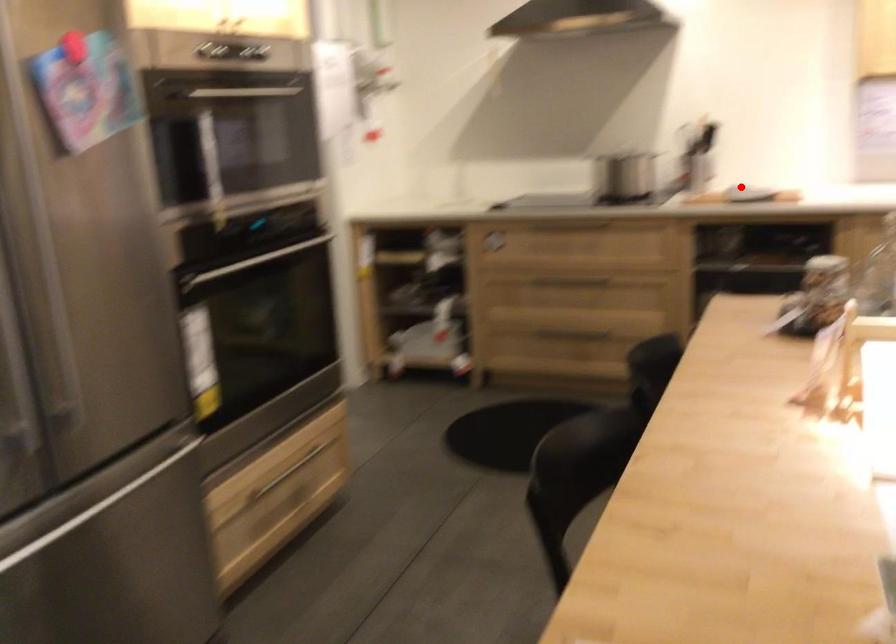
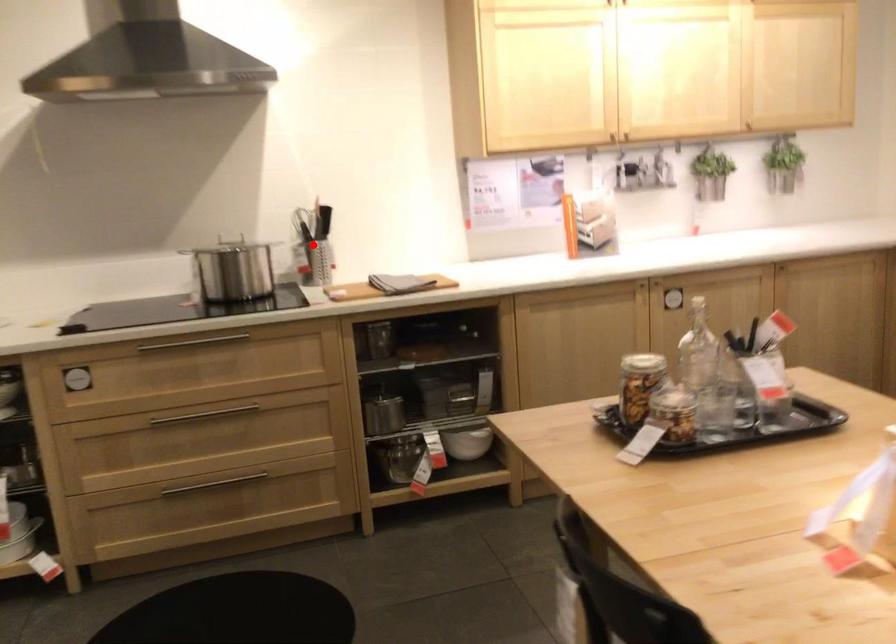
I am providing you with two images of the same scene from different viewpoints. A red point is marked on the first image and another point is marked on the second image. Is the red point in image1 aligned with the point shown in image2?

No